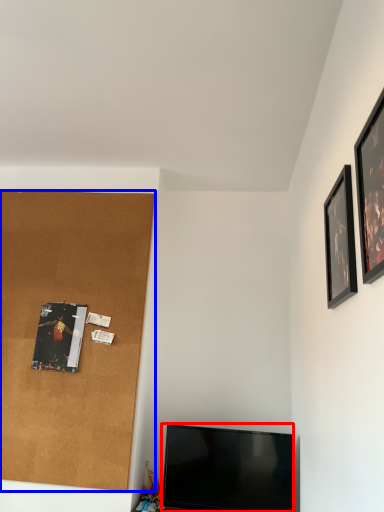
Question: Which object appears farthest to the camera in this image, television (highlighted by a red box) or plywood (highlighted by a blue box)?

Choices:
 (A) television
 (B) plywood

Answer: (B)